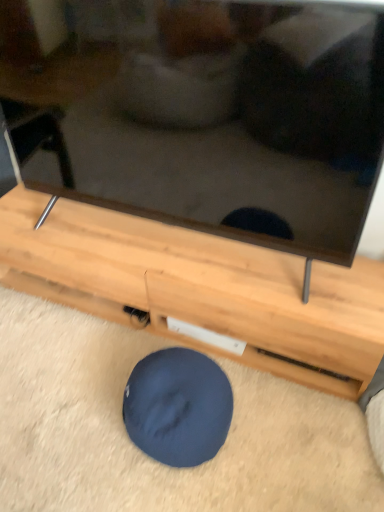
Locate an element on the screen. The image size is (384, 512). vacant area located to the right-hand side of dark blue fabric dog bed at lower center is located at coordinates (276, 436).